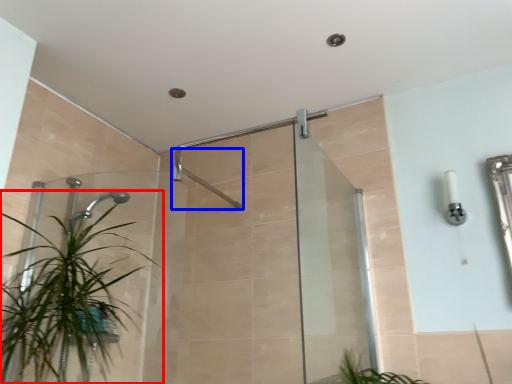
Question: Among these objects, which one is nearest to the camera, houseplant (highlighted by a red box) or shower (highlighted by a blue box)?

Choices:
 (A) houseplant
 (B) shower

Answer: (A)